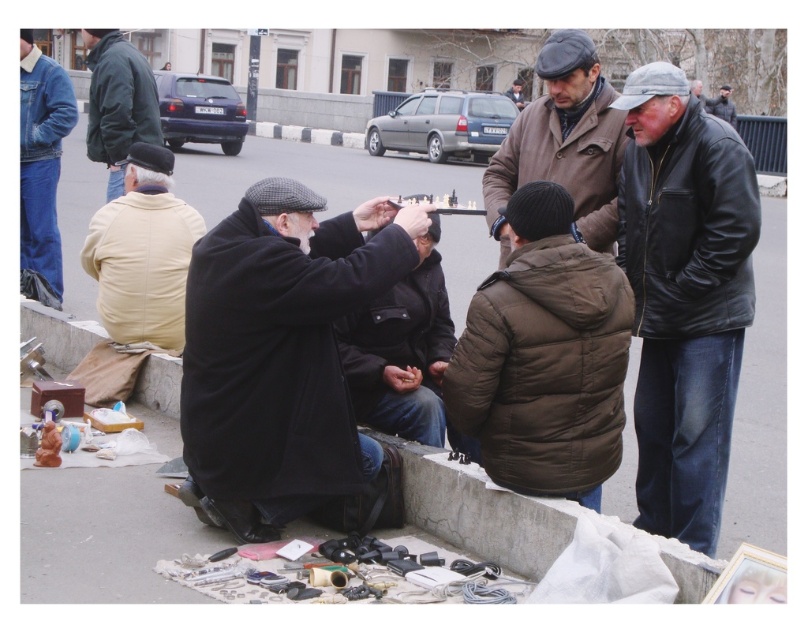
Can you confirm if light beige jacket at left is positioned above dark green jacket at upper left?

Actually, light beige jacket at left is below dark green jacket at upper left.

Measure the distance between light beige jacket at left and camera.

The distance of light beige jacket at left from camera is 21.33 feet.

Identify the location of light beige jacket at left. This screenshot has width=808, height=640. (142, 253).

Does brown leather jacket at upper center have a lesser width compared to dark green jacket at upper left?

No.

Does point (565, 49) come farther from viewer compared to point (112, 189)?

No, (565, 49) is closer to viewer.

Is point (546, 77) less distant than point (95, 90)?

Yes.

You are a GUI agent. You are given a task and a screenshot of the screen. Output one action in this format:
    pyautogui.click(x=<x>, y=<y>)
    Task: Click on the brown leather jacket at upper center
    This screenshot has height=640, width=808.
    Given the screenshot: What is the action you would take?
    pyautogui.click(x=562, y=141)

Locate an element on the screen. concrete pavement at center is located at coordinates (760, 404).

Is concrete pavement at center to the left of dark green jacket at upper left from the viewer's perspective?

Incorrect, concrete pavement at center is not on the left side of dark green jacket at upper left.

Which is behind, point (755, 401) or point (112, 54)?

The point (112, 54) is behind.

Image resolution: width=808 pixels, height=640 pixels. In order to click on concrete pavement at center in this screenshot , I will do `click(760, 404)`.